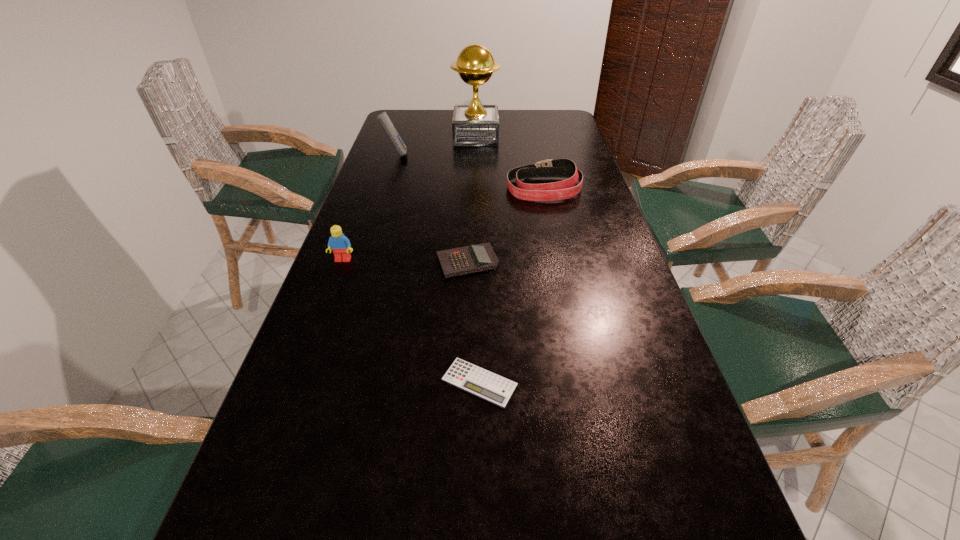
This screenshot has width=960, height=540. I want to click on empty space between the tallest calculator and the nearest calculator, so click(438, 268).

The height and width of the screenshot is (540, 960). What are the coordinates of `empty location between the third farthest object and the third tallest object` in the screenshot? It's located at (444, 224).

Where is `blank region between the farthest object and the farthest calculator`? blank region between the farthest object and the farthest calculator is located at coordinates (436, 146).

Identify the location of the fifth closest object to the second shortest object. (473, 125).

Locate an element on the screen. The width and height of the screenshot is (960, 540). object that ranks as the closest to the nearest calculator is located at coordinates (475, 258).

At what (x,y) coordinates should I click in order to perform the action: click on the second closest calculator relative to the shortest calculator. Please return your answer as a coordinate pair (x, y). Looking at the image, I should click on (383, 118).

This screenshot has height=540, width=960. Find the location of `calculator that is the closest one to the second farthest calculator`. calculator that is the closest one to the second farthest calculator is located at coordinates (473, 379).

The image size is (960, 540). Find the location of `vacant space that satisfies the following two spatial constraints: 1. on the front-facing side of the farthest object; 2. on the left side of the rightmost object`. vacant space that satisfies the following two spatial constraints: 1. on the front-facing side of the farthest object; 2. on the left side of the rightmost object is located at coordinates (475, 188).

Locate an element on the screen. The width and height of the screenshot is (960, 540). vacant space that satisfies the following two spatial constraints: 1. on the front-facing side of the award; 2. on the back side of the nearest calculator is located at coordinates (472, 382).

This screenshot has width=960, height=540. Find the location of `vacant region that satisfies the following two spatial constraints: 1. on the front-facing side of the tallest object; 2. on the face of the third tallest object`. vacant region that satisfies the following two spatial constraints: 1. on the front-facing side of the tallest object; 2. on the face of the third tallest object is located at coordinates (474, 260).